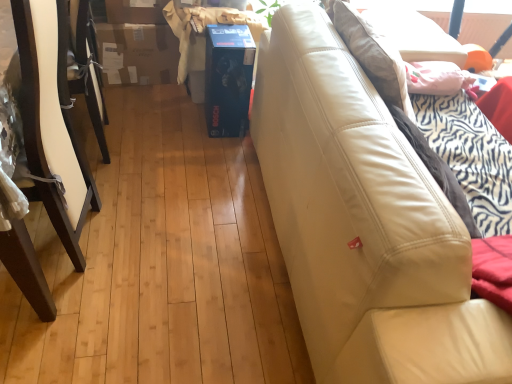
Image resolution: width=512 pixels, height=384 pixels. Describe the element at coordinates (364, 223) in the screenshot. I see `beige leather couch at right` at that location.

Locate an element on the screen. Image resolution: width=512 pixels, height=384 pixels. beige leather couch at right is located at coordinates (364, 223).

Identify the location of white painted wood chair at left. (48, 117).

What do you see at coordinates (48, 117) in the screenshot?
I see `white painted wood chair at left` at bounding box center [48, 117].

Where is `beige leather couch at right`? The height and width of the screenshot is (384, 512). beige leather couch at right is located at coordinates (364, 223).

Is white painted wood chair at left to the left of beige leather couch at right from the viewer's perspective?

Yes.

Which object is more forward, white painted wood chair at left or beige leather couch at right?

beige leather couch at right is more forward.

Which is behind, point (75, 166) or point (380, 143)?

The point (75, 166) is farther.

From the image's perspective, relative to beige leather couch at right, is white painted wood chair at left above or below?

white painted wood chair at left is situated higher than beige leather couch at right in the image.

From a real-world perspective, is white painted wood chair at left positioned above or below beige leather couch at right?

In terms of real-world spatial position, white painted wood chair at left is above beige leather couch at right.

Between white painted wood chair at left and beige leather couch at right, which one has smaller width?

Thinner between the two is beige leather couch at right.

Between white painted wood chair at left and beige leather couch at right, which one has less height?

white painted wood chair at left.

Can you confirm if white painted wood chair at left is smaller than beige leather couch at right?

Correct, white painted wood chair at left occupies less space than beige leather couch at right.

Is white painted wood chair at left located outside beige leather couch at right?

Absolutely, white painted wood chair at left is external to beige leather couch at right.

Is white painted wood chair at left directly adjacent to beige leather couch at right?

white painted wood chair at left is not next to beige leather couch at right, and they're not touching.

Is white painted wood chair at left positioned with its back to beige leather couch at right?

white painted wood chair at left does not have its back to beige leather couch at right.

This screenshot has height=384, width=512. I want to click on furniture above the beige leather couch at right (from the image's perspective), so [x=48, y=117].

Does beige leather couch at right appear on the right side of white painted wood chair at left?

Indeed, beige leather couch at right is positioned on the right side of white painted wood chair at left.

Relative to white painted wood chair at left, is beige leather couch at right in front or behind?

beige leather couch at right is in front of white painted wood chair at left.

Is point (365, 239) positioned before point (74, 221)?

Yes.

From the image's perspective, does beige leather couch at right appear higher than white painted wood chair at left?

No, from the image's perspective, beige leather couch at right is not on top of white painted wood chair at left.

From a real-world perspective, between beige leather couch at right and white painted wood chair at left, who is vertically higher?

In real-world perspective, white painted wood chair at left is above.

Considering the sizes of beige leather couch at right and white painted wood chair at left in the image, is beige leather couch at right wider or thinner than white painted wood chair at left?

Clearly, beige leather couch at right has less width compared to white painted wood chair at left.

Which of these two, beige leather couch at right or white painted wood chair at left, stands taller?

Standing taller between the two is beige leather couch at right.

Does beige leather couch at right have a larger size compared to white painted wood chair at left?

Indeed, beige leather couch at right has a larger size compared to white painted wood chair at left.

Based on the photo, which is correct: beige leather couch at right is inside white painted wood chair at left, or outside of it?

beige leather couch at right exists outside the volume of white painted wood chair at left.

Are beige leather couch at right and white painted wood chair at left making contact?

beige leather couch at right is not next to white painted wood chair at left, and they're not touching.

Is beige leather couch at right oriented towards white painted wood chair at left?

No, beige leather couch at right is not turned towards white painted wood chair at left.

What's the angular difference between beige leather couch at right and white painted wood chair at left's facing directions?

90.2 degrees.

Image resolution: width=512 pixels, height=384 pixels. In the image, there is a white painted wood chair at left. Find the location of `studio couch below it (from the image's perspective)`. studio couch below it (from the image's perspective) is located at coordinates (364, 223).

Find the location of a particular element. The image size is (512, 384). furniture above the beige leather couch at right (from the image's perspective) is located at coordinates (48, 117).

The height and width of the screenshot is (384, 512). In the image, there is a white painted wood chair at left. In order to click on studio couch below it (from the image's perspective) in this screenshot , I will do [364, 223].